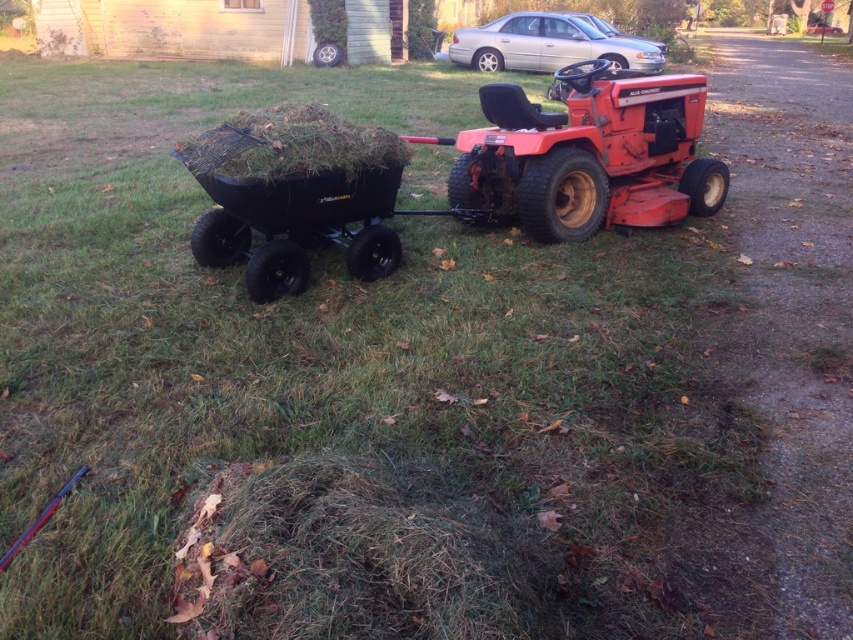
Who is positioned more to the left, matte red tractor at center or black rubber cart at center?

black rubber cart at center

Who is shorter, matte red tractor at center or black rubber cart at center?

Standing shorter between the two is black rubber cart at center.

Find the location of a particular element. Image resolution: width=853 pixels, height=640 pixels. matte red tractor at center is located at coordinates (585, 156).

Identify the location of matte red tractor at center. (585, 156).